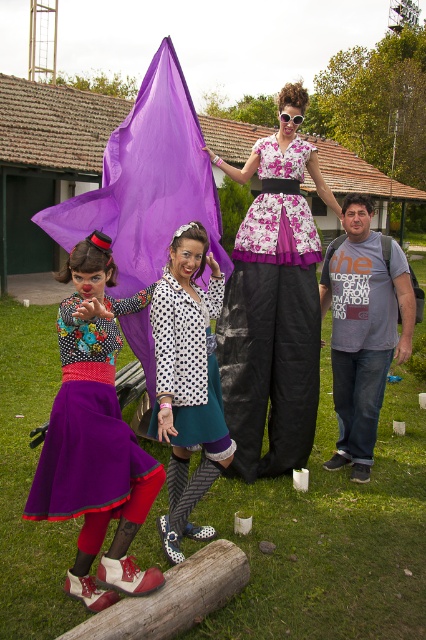
You are a photographer trying to capture a closeup shot of the clear plastic goggles at center. However, the polka dot fabric dress at center is blocking your view. Can you estimate whether the dress is wider than the goggles?

The polka dot fabric dress at center is wider than the clear plastic goggles at center, so yes, the dress is blocking the view of the goggles.

You are a photographer trying to capture the perfect shot of the polka dot fabric dress at center and the clear plastic goggles at center. Based on their positions, which object should you focus on first if you want to ensure both are in the frame without moving the camera?

The polka dot fabric dress at center is below the clear plastic goggles at center, so you should focus on the clear plastic goggles at center first to ensure both are in the frame without moving the camera.

You are a photographer positioned at the edge of the stage. You need to capture both the floral fabric dress at center and the matte purple skirt at lower left in a single shot. Which subject should you position closer to the left side of the frame to ensure both are visible?

You should position the matte purple skirt at lower left closer to the left side of the frame since it is already located to the left of the floral fabric dress at center.